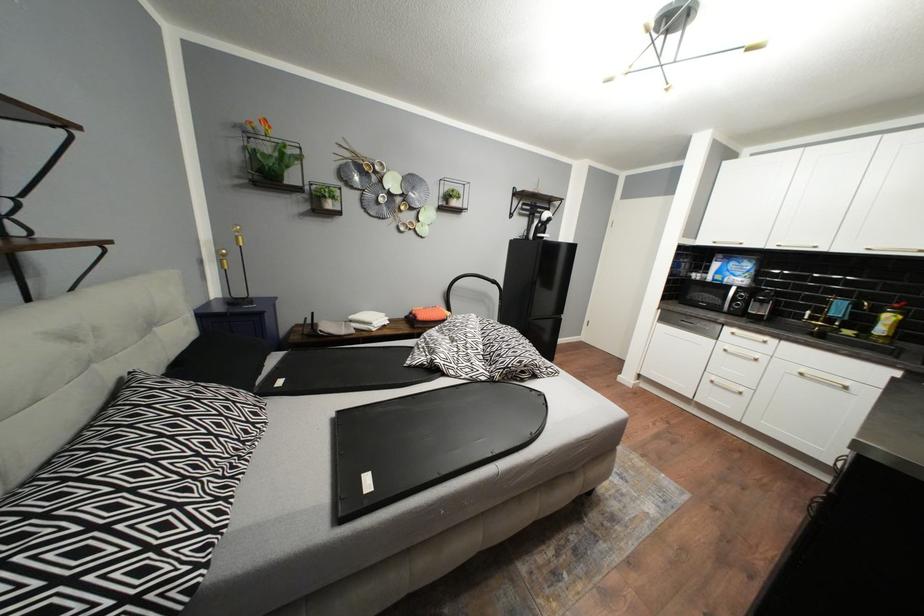
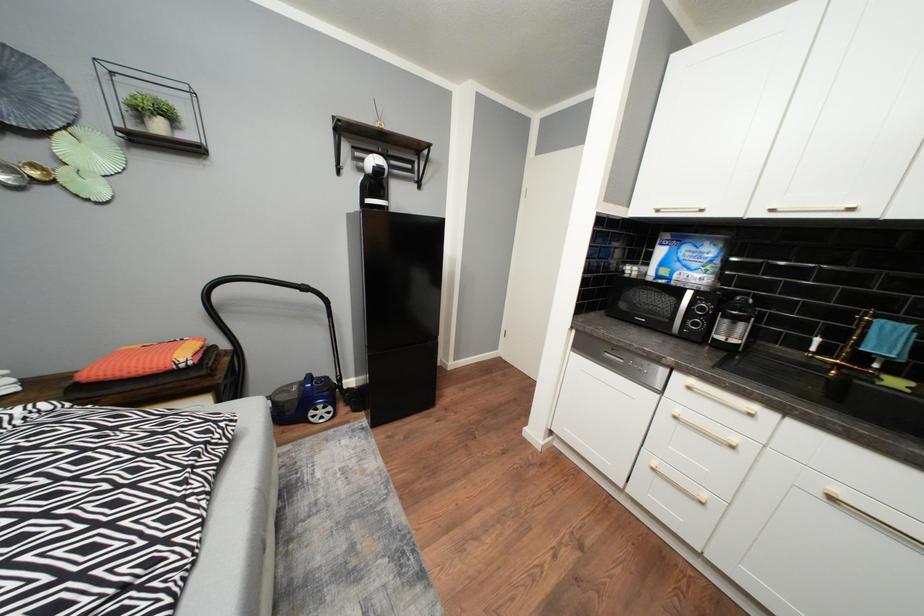
In a continuous first-person perspective shot, in which direction is the camera moving?

The cameraman walked toward right, forward.